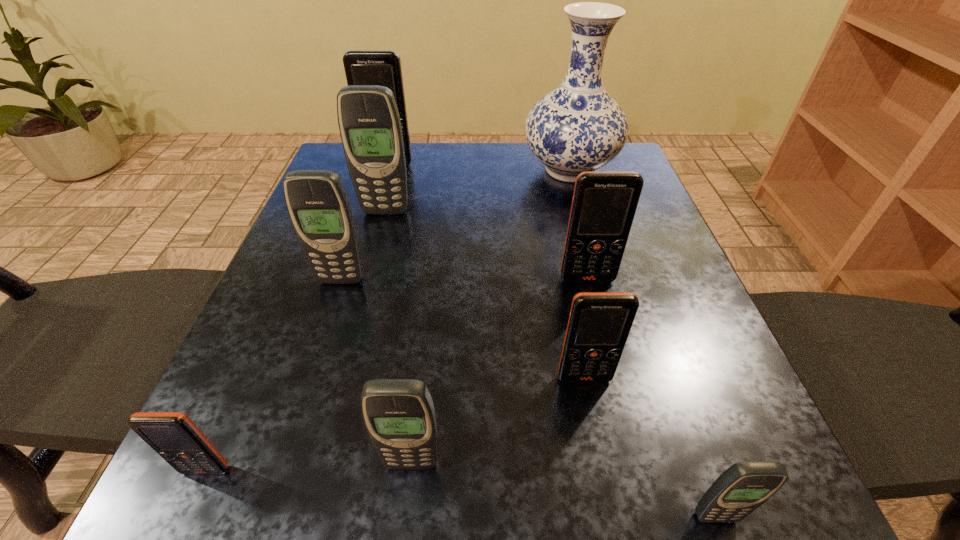
Image resolution: width=960 pixels, height=540 pixels. What are the coordinates of `the tallest object` in the screenshot? It's located at (578, 127).

The image size is (960, 540). I want to click on vase, so click(x=578, y=127).

Image resolution: width=960 pixels, height=540 pixels. Identify the location of the farthest cellular telephone. (362, 67).

At what (x,y) coordinates should I click in order to perform the action: click on the second orange cellular telephone from left to right. Please return your answer as a coordinate pair (x, y). Looking at the image, I should click on (362, 67).

You are a GUI agent. You are given a task and a screenshot of the screen. Output one action in this format:
    pyautogui.click(x=<x>, y=<y>)
    Task: Click on the biggest gray cellular telephone
    
    Given the screenshot: What is the action you would take?
    pyautogui.click(x=370, y=128)

You are a GUI agent. You are given a task and a screenshot of the screen. Output one action in this format:
    pyautogui.click(x=<x>, y=<y>)
    Task: Click on the seventh nearest cellular telephone
    The height and width of the screenshot is (540, 960).
    Given the screenshot: What is the action you would take?
    pyautogui.click(x=370, y=128)

What are the coordinates of `the third nearest orange cellular telephone` in the screenshot? It's located at (604, 204).

This screenshot has height=540, width=960. Identify the location of the third smallest gray cellular telephone. (318, 205).

Image resolution: width=960 pixels, height=540 pixels. In order to click on the third biggest gray cellular telephone in this screenshot , I will do `click(399, 415)`.

I want to click on the third gray cellular telephone from left to right, so click(399, 415).